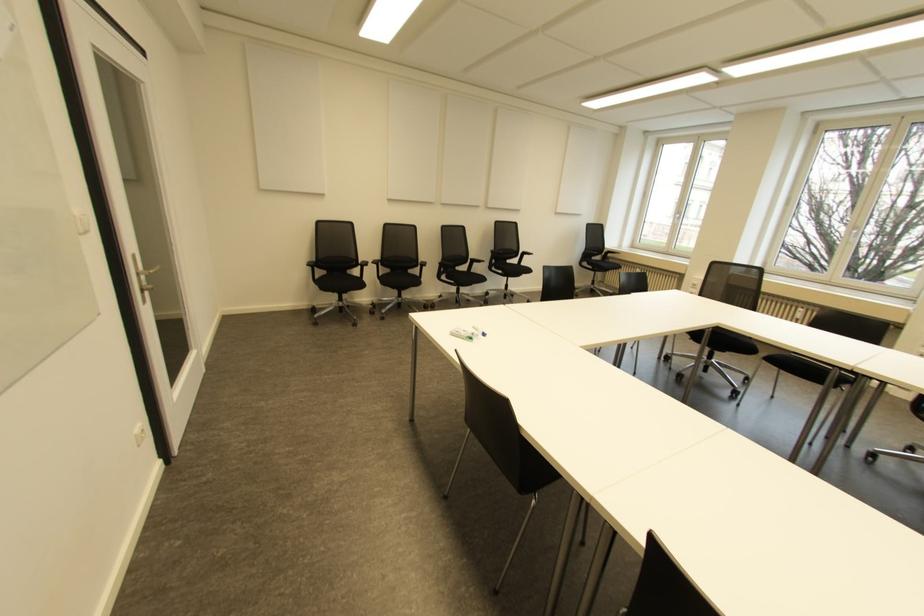
The height and width of the screenshot is (616, 924). What do you see at coordinates (319, 262) in the screenshot? I see `the black chair armrest` at bounding box center [319, 262].